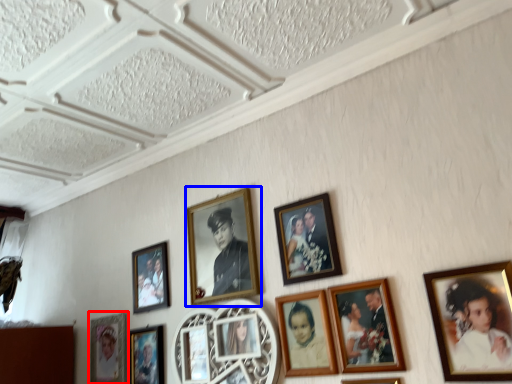
Question: Which object is further to the camera taking this photo, picture frame (highlighted by a red box) or picture frame (highlighted by a blue box)?

Choices:
 (A) picture frame
 (B) picture frame

Answer: (A)